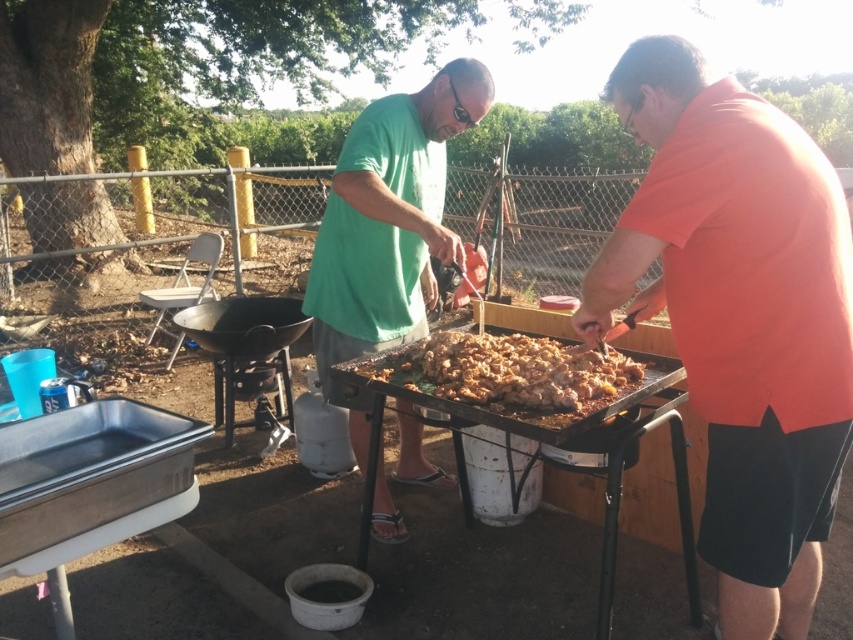
Does orange matte shirt at center have a lesser height compared to green matte shirt at center?

Indeed, orange matte shirt at center has a lesser height compared to green matte shirt at center.

At what (x,y) coordinates should I click in order to perform the action: click on orange matte shirt at center. Please return your answer as a coordinate pair (x, y). The image size is (853, 640). Looking at the image, I should click on (740, 317).

Between orange matte shirt at center and brown crumbly meat at center, which one has less height?

Standing shorter between the two is brown crumbly meat at center.

Is orange matte shirt at center taller than brown crumbly meat at center?

Indeed, orange matte shirt at center has a greater height compared to brown crumbly meat at center.

Identify the location of orange matte shirt at center. The height and width of the screenshot is (640, 853). click(740, 317).

Is green matte shirt at center wider than brown crumbly meat at center?

No, green matte shirt at center is not wider than brown crumbly meat at center.

Is green matte shirt at center above brown crumbly meat at center?

Indeed, green matte shirt at center is positioned over brown crumbly meat at center.

The image size is (853, 640). What are the coordinates of `green matte shirt at center` in the screenshot? It's located at (387, 227).